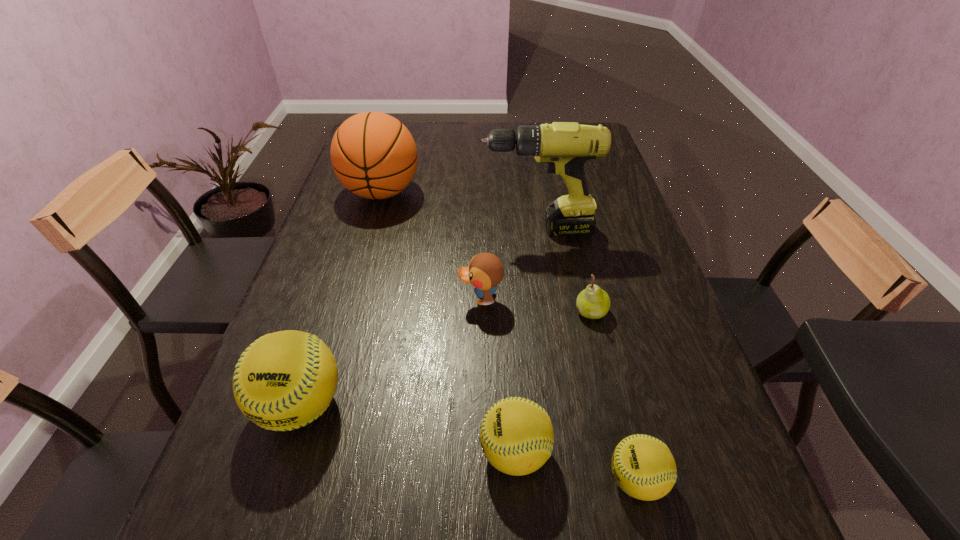
Identify the location of free space between the fifth shortest object and the second farthest object. Image resolution: width=960 pixels, height=540 pixels. (419, 318).

Where is `free spot between the pear and the basketball`? This screenshot has height=540, width=960. free spot between the pear and the basketball is located at coordinates (486, 252).

Where is `free space that is in between the fifth shortest object and the basketball`? free space that is in between the fifth shortest object and the basketball is located at coordinates pyautogui.click(x=341, y=298).

Locate an element on the screen. vacant space that's between the pear and the farthest object is located at coordinates (486, 252).

The width and height of the screenshot is (960, 540). In order to click on empty space that is in between the drill and the fifth shortest object in this screenshot , I will do (419, 318).

Identify the location of free space between the farthest object and the second softball from left to right. The height and width of the screenshot is (540, 960). (448, 322).

Where is `empty space that is in between the shortest object and the pear`? empty space that is in between the shortest object and the pear is located at coordinates (613, 396).

Select which object appears as the sixth closest to the duck. Please provide its 2D coordinates. Your answer should be formatted as a tuple, i.e. [(x, y)], where the tuple contains the x and y coordinates of a point satisfying the conditions above.

[(644, 468)]

What are the coordinates of `the second closest object to the pear` in the screenshot? It's located at (565, 146).

Identify the location of the closest softball to the tallest softball. (516, 435).